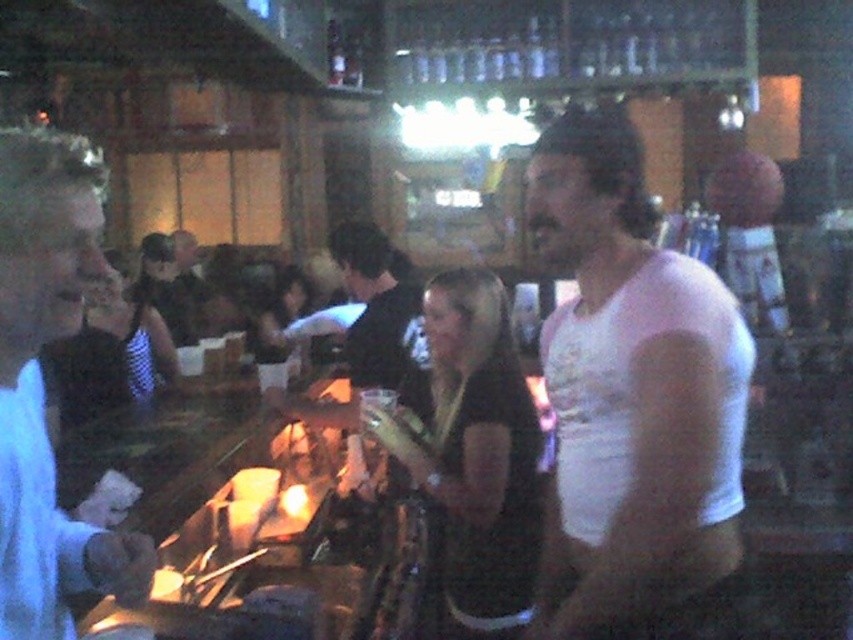
You are a photographer positioned at the entrance of the bar. You want to take a photo of both the black matte dress at center and the black mesh dress at center. Which dress will appear larger in the photo?

The black matte dress at center will appear larger in the photo because it is closer to the viewer than the black mesh dress at center.

You are standing at the bar in the image and need to reach both the point at coordinates point (126,326) and the point at coordinates point (169,280). Which point is closer to you?

Point (126,326) is in front of point (169,280), so it is closer to you.

You are standing in the bar scene and want to place a small object on the table. You have two options for placement locations marked as point 1 at coordinates point (479, 342) and point 2 at coordinates point (120, 284). Which point is closer to you where you can place the object more easily?

Point (479, 342) is closer to the viewer than point (120, 284), so placing the object there would be easier.